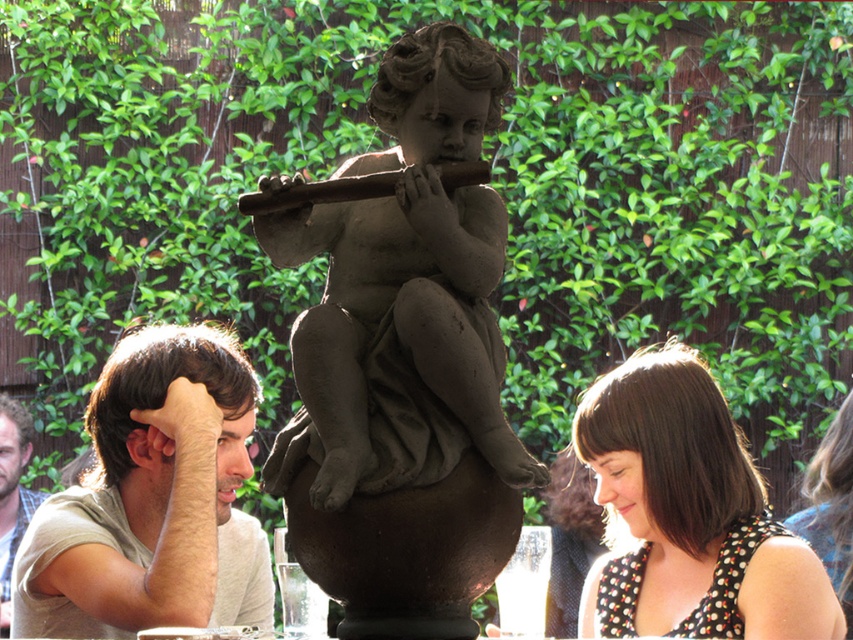
Between point (30, 604) and point (825, 500), which one is positioned behind?

Positioned behind is point (825, 500).

Does light brown hair at left appear on the left side of polka dot blouse at lower right?

Correct, you'll find light brown hair at left to the left of polka dot blouse at lower right.

I want to click on light brown hair at left, so click(x=152, y=499).

Is matte gray statue at center shorter than polka dot fabric dress at lower right?

No, matte gray statue at center is not shorter than polka dot fabric dress at lower right.

Who is positioned more to the right, matte gray statue at center or polka dot fabric dress at lower right?

From the viewer's perspective, polka dot fabric dress at lower right appears more on the right side.

Does point (437, 428) lie in front of point (709, 460)?

Yes, point (437, 428) is in front of point (709, 460).

I want to click on matte gray statue at center, so click(x=404, y=362).

Find the location of a particular element. polka dot fabric dress at lower right is located at coordinates (688, 515).

Which is more to the left, polka dot fabric dress at lower right or polka dot blouse at lower right?

Positioned to the left is polka dot fabric dress at lower right.

This screenshot has width=853, height=640. Describe the element at coordinates (688, 515) in the screenshot. I see `polka dot fabric dress at lower right` at that location.

The image size is (853, 640). I want to click on polka dot fabric dress at lower right, so click(x=688, y=515).